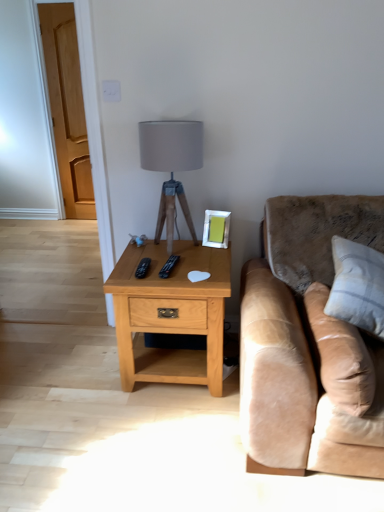
Find the location of a particular element. free space that is to the left of light oak wood nightstand at center is located at coordinates (73, 381).